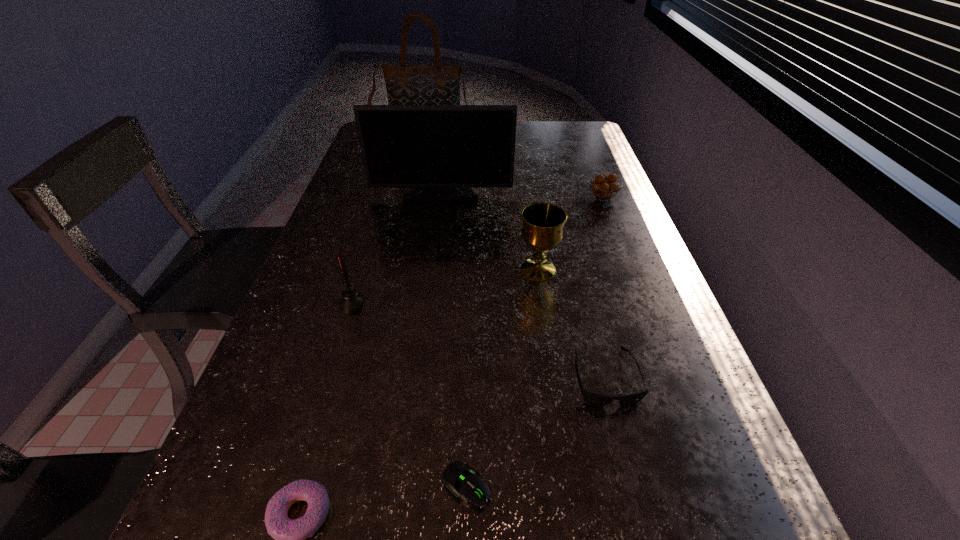
Where is `blank area located on the screen side of the seventh shortest object`? blank area located on the screen side of the seventh shortest object is located at coordinates (437, 232).

Image resolution: width=960 pixels, height=540 pixels. I want to click on free spot located 0.110m on the right of the chalice, so click(x=604, y=269).

Where is `vacant space located on the back of the fifth farthest object`? This screenshot has height=540, width=960. vacant space located on the back of the fifth farthest object is located at coordinates (366, 255).

What are the coordinates of `free space located on the back of the rightmost object` in the screenshot? It's located at (582, 144).

Where is `free space located on the front-facing side of the sixth farthest object`? free space located on the front-facing side of the sixth farthest object is located at coordinates (636, 501).

Where is `vacant space situated 0.400m on the right of the shortest object`? This screenshot has width=960, height=540. vacant space situated 0.400m on the right of the shortest object is located at coordinates (745, 485).

At what (x,y) coordinates should I click in order to perform the action: click on object that is positioned at the far edge. Please return your answer as a coordinate pair (x, y). The width and height of the screenshot is (960, 540). Looking at the image, I should click on tap(439, 84).

You are a GUI agent. You are given a task and a screenshot of the screen. Output one action in this format:
    pyautogui.click(x=<x>, y=<y>)
    Task: Click on the handbag at the left edge
    The height and width of the screenshot is (540, 960).
    Given the screenshot: What is the action you would take?
    pyautogui.click(x=439, y=84)

Where is `monitor that is at the left edge`? Image resolution: width=960 pixels, height=540 pixels. monitor that is at the left edge is located at coordinates (441, 151).

Image resolution: width=960 pixels, height=540 pixels. In order to click on candle that is at the left edge in this screenshot , I will do `click(351, 300)`.